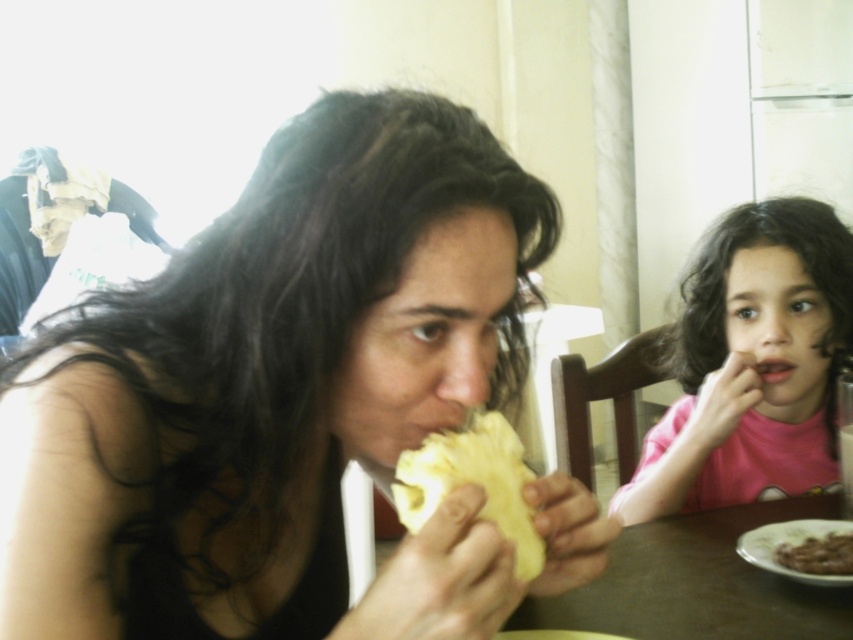
Question: Does brown wooden table at lower center appear on the right side of yellow matte pineapple at center?

Choices:
 (A) no
 (B) yes

Answer: (B)

Question: Does brown wooden table at lower center appear on the left side of brown crumbly cake at lower right?

Choices:
 (A) yes
 (B) no

Answer: (A)

Question: Can you confirm if brown wooden table at lower center is wider than yellow matte pineapple at center?

Choices:
 (A) no
 (B) yes

Answer: (B)

Question: Which object appears closest to the camera in this image?

Choices:
 (A) brown crumbly cake at lower right
 (B) brown wooden table at lower center
 (C) yellow matte bread at center

Answer: (C)

Question: Which of the following is the closest to the observer?

Choices:
 (A) (82, 449)
 (B) (561, 602)
 (C) (521, 548)

Answer: (A)

Question: Among these points, which one is nearest to the camera?

Choices:
 (A) (445, 483)
 (B) (659, 524)
 (C) (619, 499)
 (D) (851, 532)

Answer: (A)